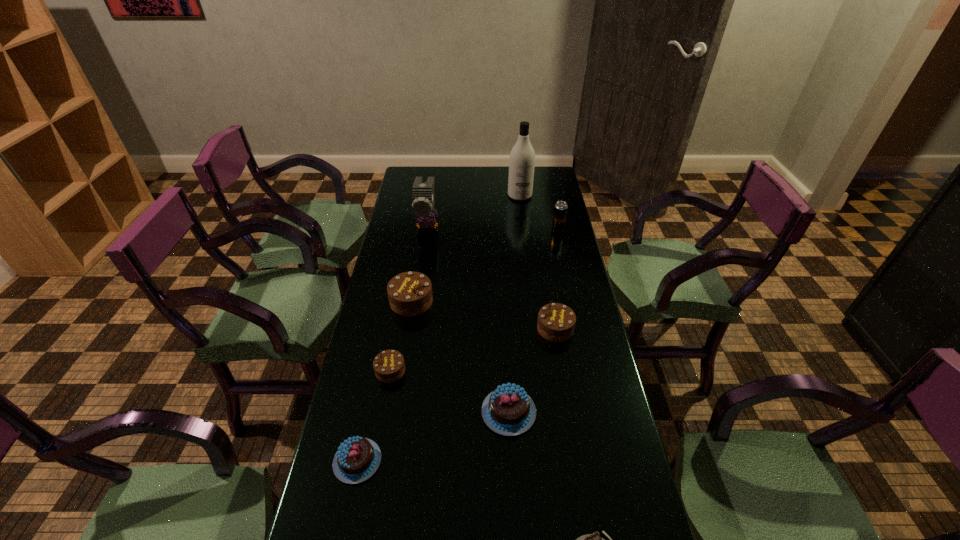
Find the location of `the fourth nearest object`. the fourth nearest object is located at coordinates (389, 366).

This screenshot has width=960, height=540. What are the coordinates of `the fifth farthest chocolate cake` in the screenshot? It's located at (357, 459).

You are a GUI agent. You are given a task and a screenshot of the screen. Output one action in this format:
    pyautogui.click(x=<x>, y=<y>)
    Task: Click on the eighth farthest object
    The height and width of the screenshot is (540, 960).
    Given the screenshot: What is the action you would take?
    pyautogui.click(x=357, y=459)

Find the location of a particular element. The height and width of the screenshot is (540, 960). vacant space located on the front-facing side of the white shampoo is located at coordinates (522, 219).

Find the location of `free space located 0.110m at the beak of the bird`. free space located 0.110m at the beak of the bird is located at coordinates (422, 259).

The width and height of the screenshot is (960, 540). I want to click on vacant space located on the back of the black beer can, so click(552, 200).

Find the location of `vacant space situated on the right of the tallest chocolate cake`. vacant space situated on the right of the tallest chocolate cake is located at coordinates coord(542,301).

This screenshot has height=540, width=960. I want to click on free space located 0.360m on the left of the rightmost brown chocolate cake, so click(x=426, y=328).

I want to click on vacant space located 0.210m on the back of the third nearest chocolate cake, so click(x=504, y=333).

Locate an element on the screen. vacant space positioned on the right of the sixth farthest object is located at coordinates (476, 371).